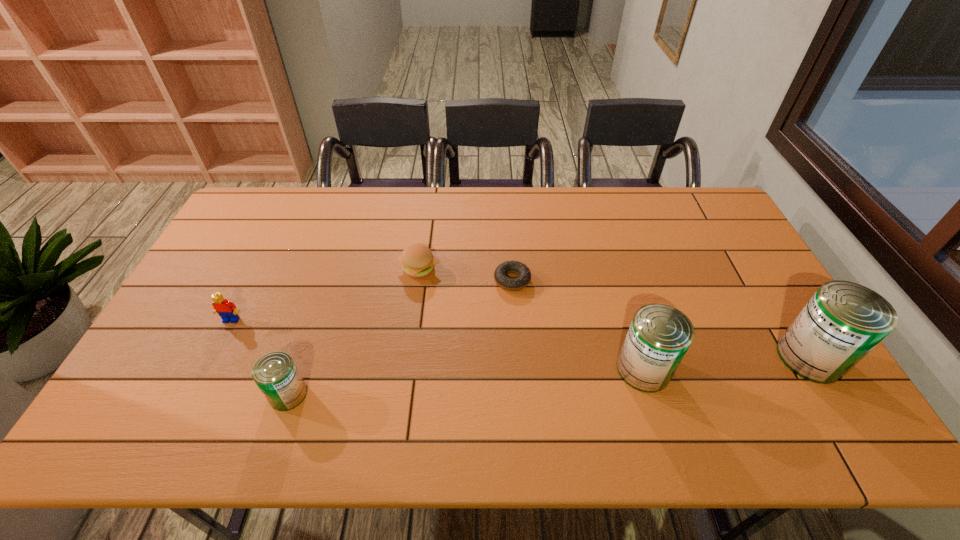
Locate an element on the screen. free space at the far edge is located at coordinates (341, 217).

At what (x,y) coordinates should I click in order to perform the action: click on vacant space at the near edge of the desktop. Please return your answer as a coordinate pair (x, y). Image resolution: width=960 pixels, height=540 pixels. Looking at the image, I should click on (526, 370).

The image size is (960, 540). What are the coordinates of `free location at the left edge` in the screenshot? It's located at (213, 260).

Image resolution: width=960 pixels, height=540 pixels. In the image, there is a desktop. Find the location of `vacant area at the right edge`. vacant area at the right edge is located at coordinates (754, 268).

This screenshot has height=540, width=960. Find the location of `vacant region at the near right corner of the desktop`. vacant region at the near right corner of the desktop is located at coordinates (769, 383).

Image resolution: width=960 pixels, height=540 pixels. Identify the location of free space between the shortest object and the leftmost can. (400, 337).

Find the location of `free spot between the Lego and the second object from left to right`. free spot between the Lego and the second object from left to right is located at coordinates (260, 357).

This screenshot has height=540, width=960. I want to click on free space that is in between the rightmost object and the Lego, so click(x=520, y=339).

The image size is (960, 540). I want to click on free space between the rightmost object and the leftmost object, so click(520, 339).

The width and height of the screenshot is (960, 540). What are the coordinates of `vacant area that lies between the rightmost can and the fourth object from right to left` in the screenshot? It's located at (614, 313).